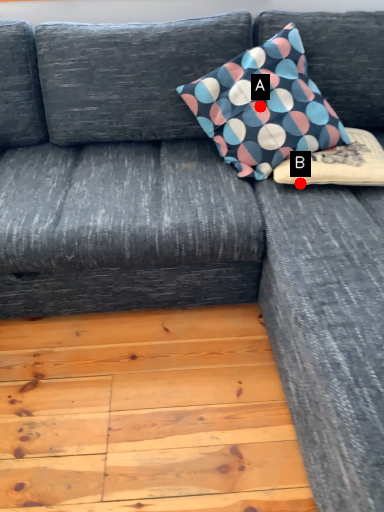
Question: Two points are circled on the image, labeled by A and B beside each circle. Which point is further to the camera?

Choices:
 (A) A is further
 (B) B is further

Answer: (A)